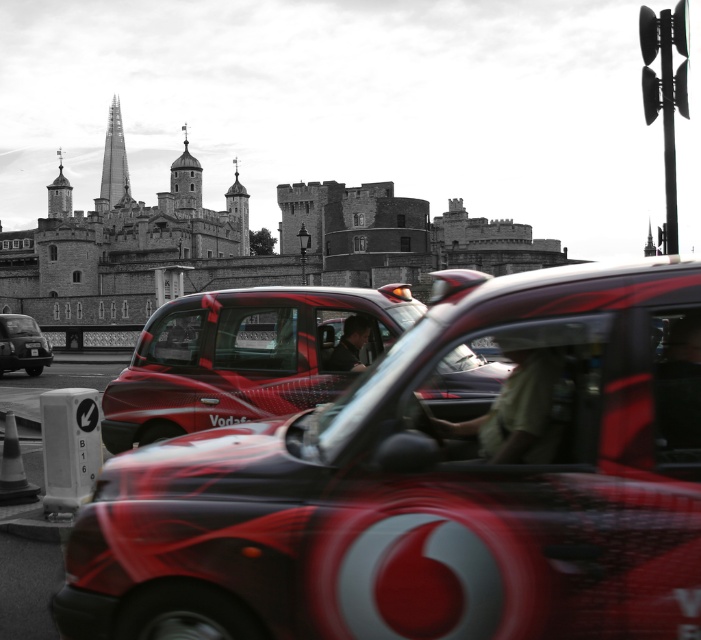
Question: Which point appears closest to the camera in this image?

Choices:
 (A) (43, 364)
 (B) (36, 353)
 (C) (149, 326)
 (D) (700, 449)

Answer: (D)

Question: Can you confirm if matte red taxi at center is thinner than metallic silver car at left?

Choices:
 (A) no
 (B) yes

Answer: (A)

Question: Which object appears farthest from the camera in this image?

Choices:
 (A) black plastic license plate at center
 (B) metallic silver car at left
 (C) matte red taxi at center
 (D) metallic red taxi at center

Answer: (A)

Question: Which of the following is the farthest from the observer?

Choices:
 (A) black plastic license plate at center
 (B) matte red taxi at center

Answer: (A)

Question: Does matte red taxi at center have a larger size compared to black plastic license plate at center?

Choices:
 (A) yes
 (B) no

Answer: (A)

Question: Can you confirm if metallic red taxi at center is positioned below matte red taxi at center?

Choices:
 (A) yes
 (B) no

Answer: (A)